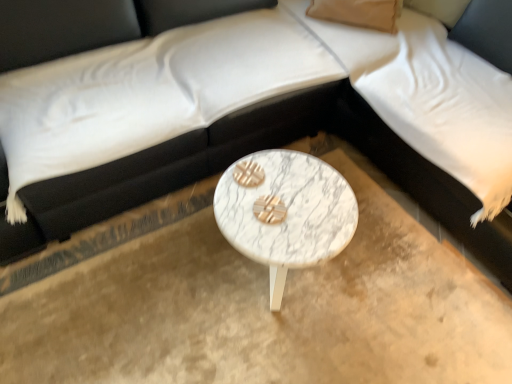
Where is `marble/whiteobject at center`? Image resolution: width=512 pixels, height=384 pixels. marble/whiteobject at center is located at coordinates (286, 213).

What is the approximate width of marble/whiteobject at center?

marble/whiteobject at center is 17.16 inches wide.

What do you see at coordinates (286, 213) in the screenshot?
I see `marble/whiteobject at center` at bounding box center [286, 213].

You are a GUI agent. You are given a task and a screenshot of the screen. Output one action in this format:
    pyautogui.click(x=<x>, y=<y>)
    Task: Click on the marble/whiteobject at center
    The height and width of the screenshot is (384, 512).
    Given the screenshot: What is the action you would take?
    pyautogui.click(x=286, y=213)